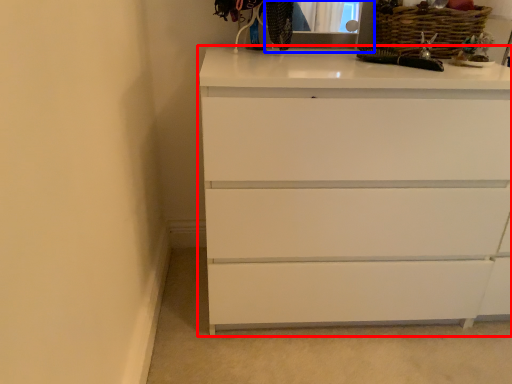
Question: Which of the following is the closest to the observer, chest of drawers (highlighted by a red box) or medicine cabinet (highlighted by a blue box)?

Choices:
 (A) chest of drawers
 (B) medicine cabinet

Answer: (A)